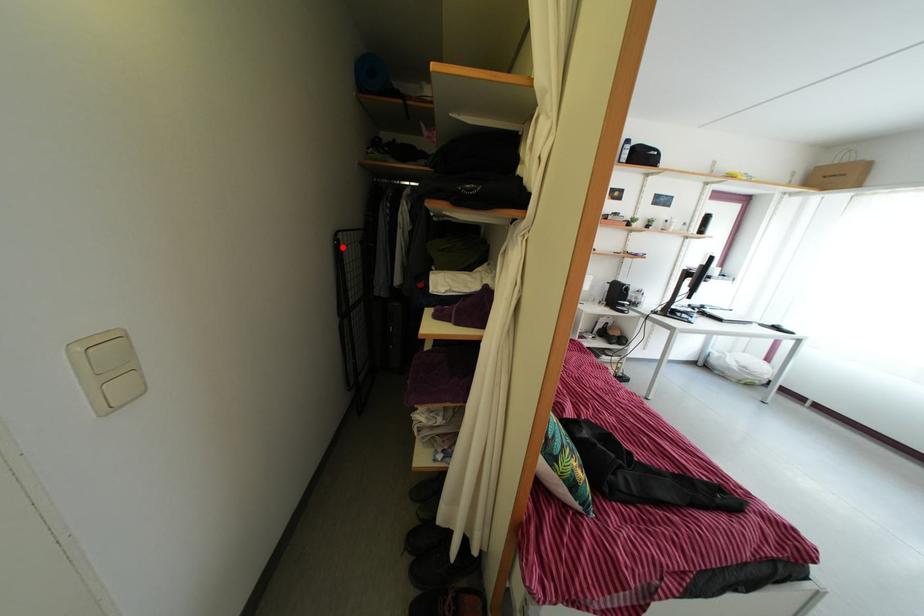
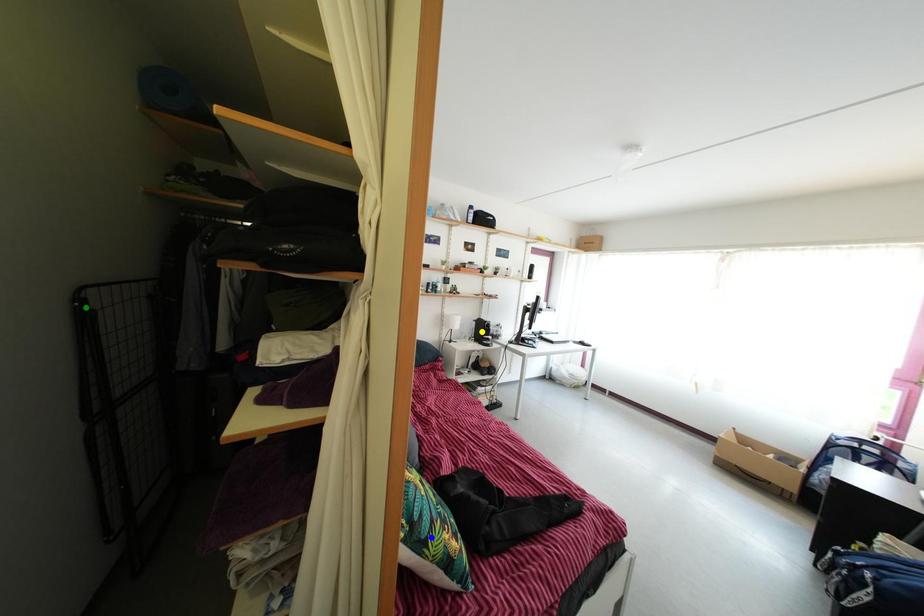
Question: I am providing you with two images of the same scene from different viewpoints. A red point is marked on the first image. You are given multiple points on the second image. Can you choose the point in image 2 that corresponds to the point in image 1?

Choices:
 (A) green point
 (B) blue point
 (C) yellow point

Answer: (A)